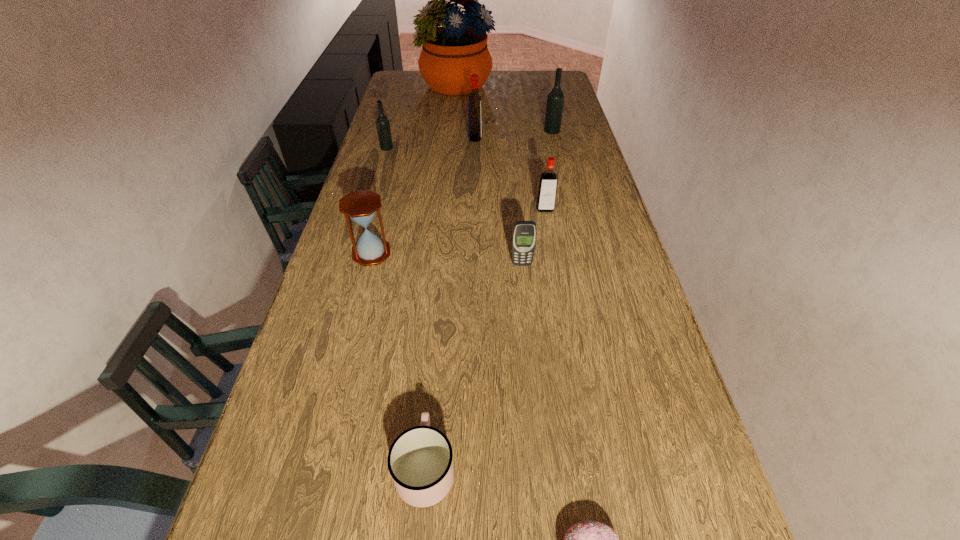
I want to click on vacant space located 0.060m on the right of the brown hourglass, so click(x=412, y=253).

I want to click on blank space located on the screen of the cellular telephone, so click(x=523, y=281).

Identify the location of free spot located on the side of the eighth tallest object with the handle. The image size is (960, 540). (441, 294).

At what (x,y) coordinates should I click in order to perform the action: click on vacant space located 0.380m on the side of the eighth tallest object with the handle. Please return your answer as a coordinate pair (x, y). The height and width of the screenshot is (540, 960). Looking at the image, I should click on (441, 291).

The image size is (960, 540). What are the coordinates of `vacant space located 0.350m on the side of the eighth tallest object with the handle` in the screenshot? It's located at (440, 300).

At what (x,y) coordinates should I click in order to perform the action: click on object at the far edge. Please return your answer as a coordinate pair (x, y). The image size is (960, 540). Looking at the image, I should click on (450, 54).

At what (x,y) coordinates should I click in order to perform the action: click on flower arrangement situated at the left edge. Please return your answer as a coordinate pair (x, y). The height and width of the screenshot is (540, 960). Looking at the image, I should click on (450, 54).

You are a GUI agent. You are given a task and a screenshot of the screen. Output one action in this format:
    pyautogui.click(x=<x>, y=<y>)
    Task: Click on the vodka located in the left edge section of the desktop
    This screenshot has width=960, height=540.
    Given the screenshot: What is the action you would take?
    pyautogui.click(x=382, y=122)

Image resolution: width=960 pixels, height=540 pixels. What are the coordinates of `hourglass that is at the left edge` in the screenshot? It's located at (361, 206).

Where is `object present at the right edge`? This screenshot has width=960, height=540. object present at the right edge is located at coordinates (555, 100).